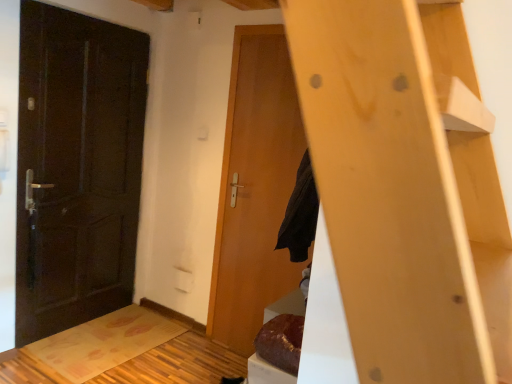
The height and width of the screenshot is (384, 512). What are the coordinates of `vacant area that lies to the right of matte dark brown door at left, which is the 1th door in left-to-right order` in the screenshot? It's located at pos(141,341).